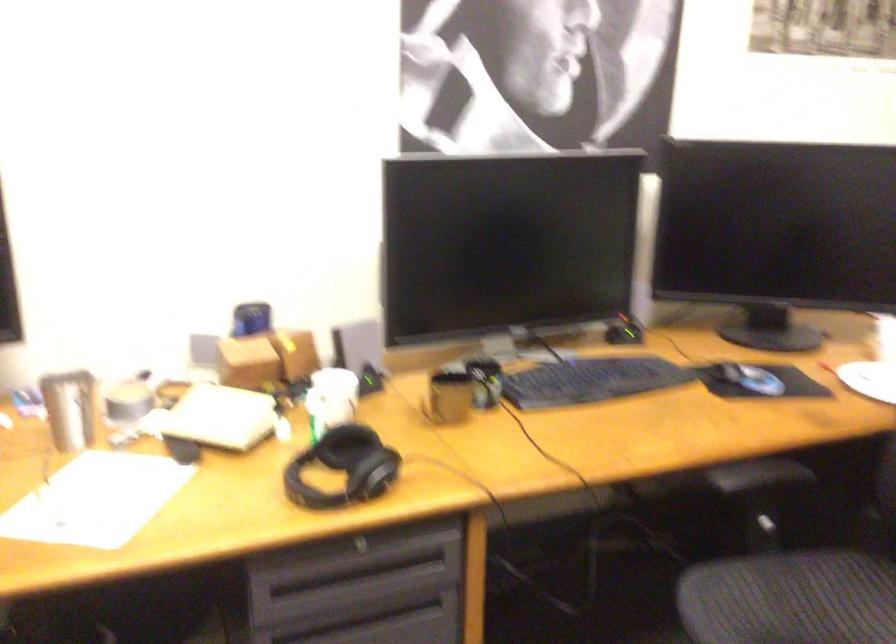
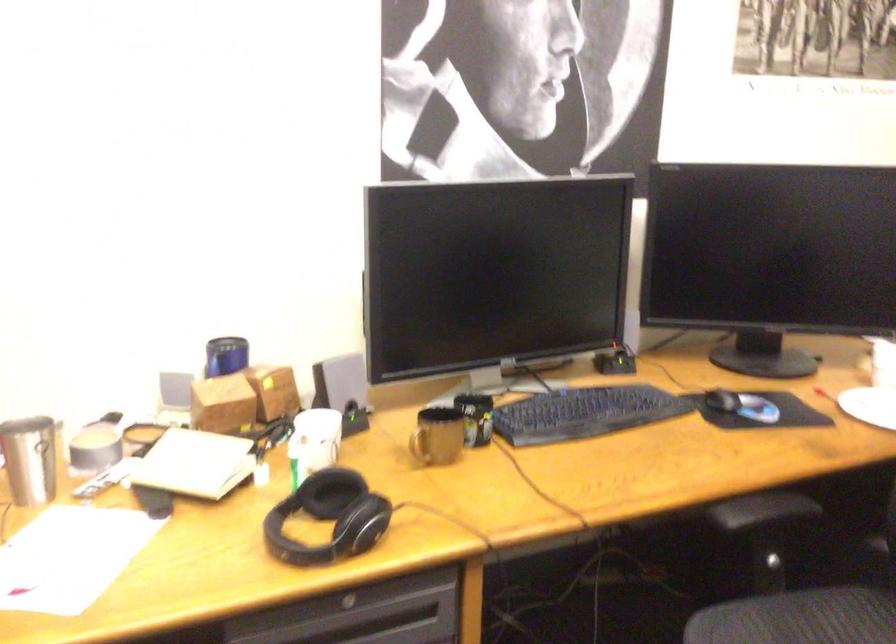
In the second image, find the point that corresponds to point (218, 417) in the first image.

(194, 464)